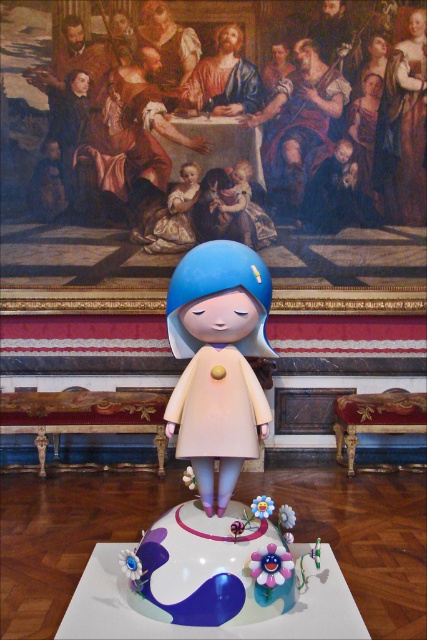
You are an art student observing the scene. You need to place a new object between the matte blue doll at center and the matte blue cake at center. Which side of the cake should you place it on to keep it aligned with the existing arrangement?

The matte blue doll at center is on the left side of the matte blue cake at center, so placing the new object to the right of the cake would maintain the alignment.

You are an art curator standing in the room and want to move from the matte blue doll at center to the matte blue cake at center. Which direction should you move to reach the cake?

The matte blue doll at center is closer to you than the matte blue cake at center, so you should move forward to reach the cake.

You are an interior designer planning to place a new decorative item in the room. You have two options from the image, the matte blue doll at center and the matte blue cake at center. Which one is taller and would be better suited for a high shelf?

The matte blue doll at center is taller than the matte blue cake at center, so it would be better suited for a high shelf.